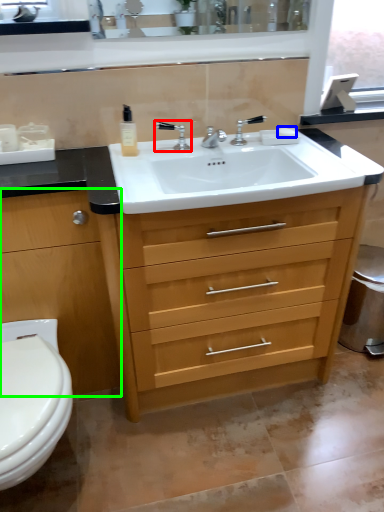
Question: Based on their relative distances, which object is farther from tap (highlighted by a red box)? Choose from soap (highlighted by a blue box) and chest of drawers (highlighted by a green box).

Choices:
 (A) soap
 (B) chest of drawers

Answer: (B)